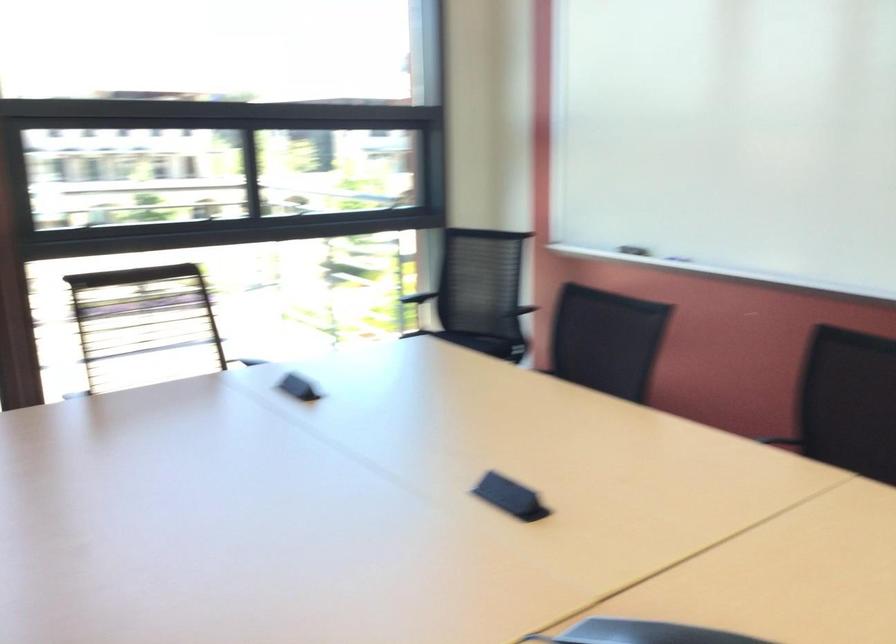
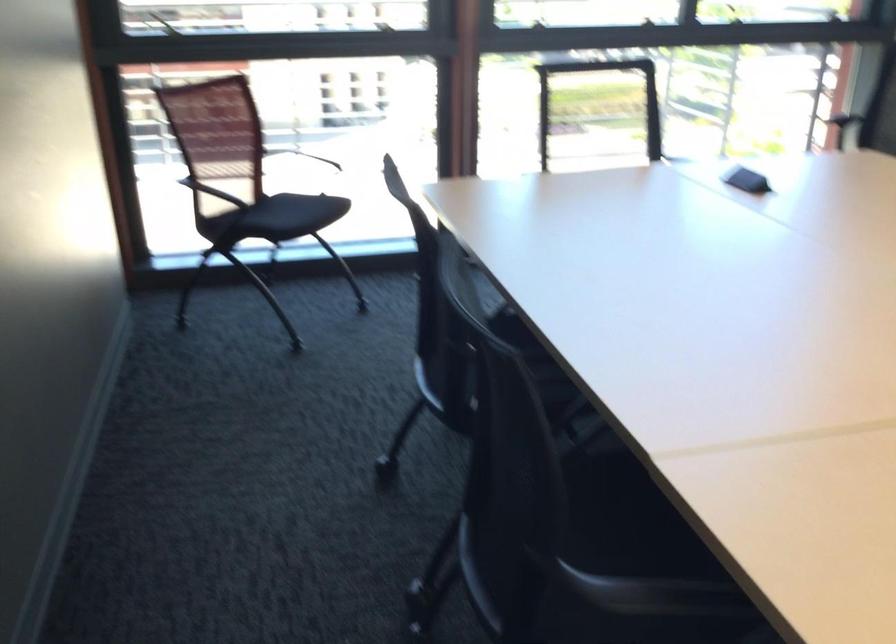
Question: The camera is either moving clockwise (left) or counter-clockwise (right) around the object. The first image is from the beginning of the video and the second image is from the end. Is the camera moving left or right when shooting the video?

Choices:
 (A) Left
 (B) Right

Answer: (B)